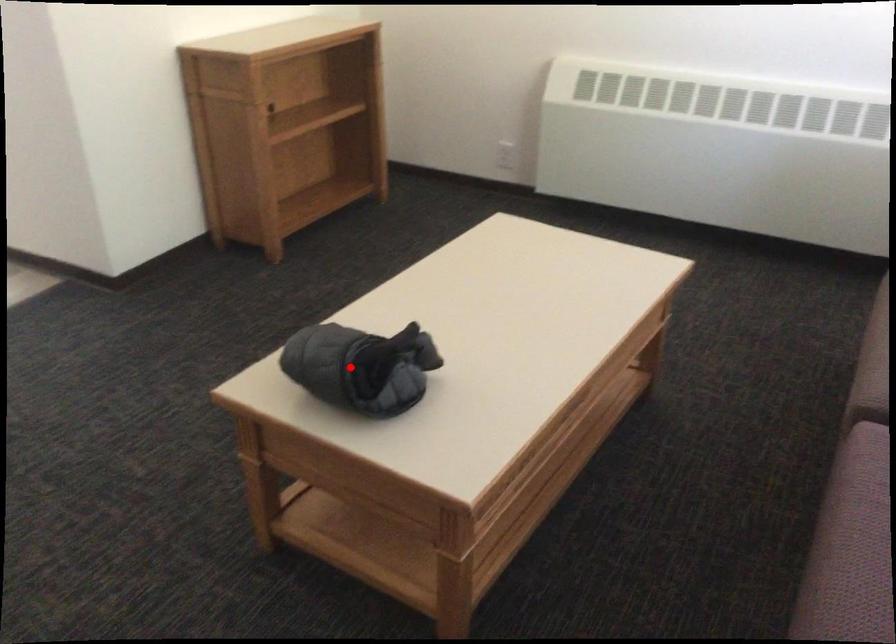
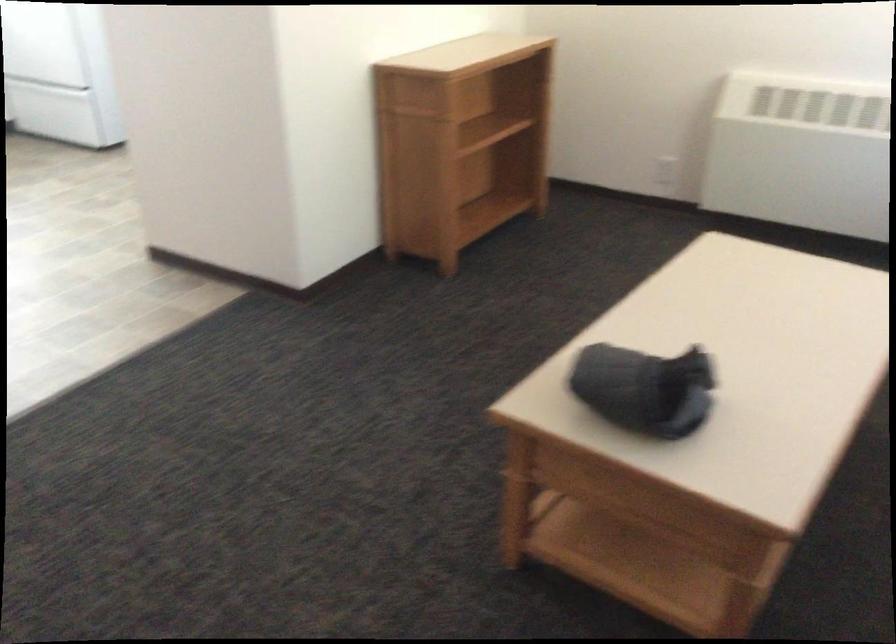
Where in the second image is the point corresponding to the highlighted location from the first image?

(644, 389)